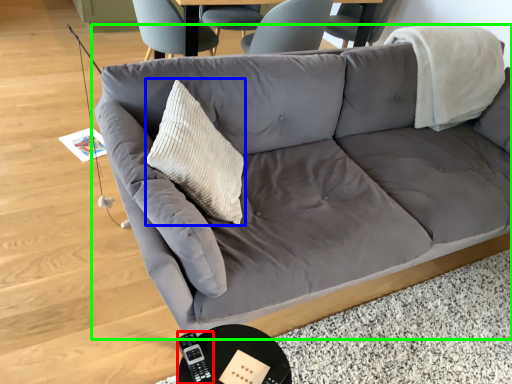
Question: Which object is positioned farthest from remote (highlighted by a red box)? Select from throw pillow (highlighted by a blue box) and studio couch (highlighted by a green box).

Choices:
 (A) throw pillow
 (B) studio couch

Answer: (B)